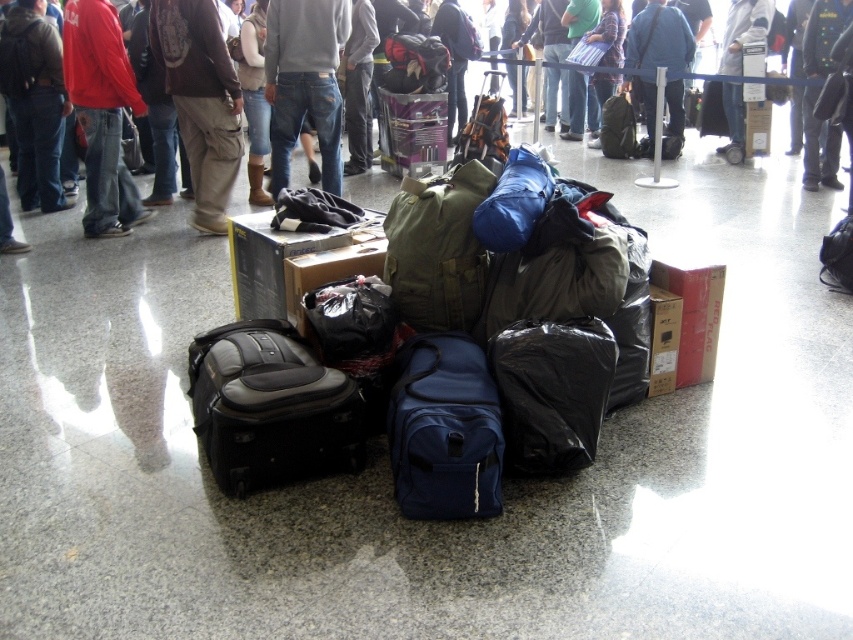
Which is below, matte black suitcase at center or navy blue fabric backpack at center?

navy blue fabric backpack at center is lower down.

Is matte black suitcase at center bigger than navy blue fabric backpack at center?

Indeed, matte black suitcase at center has a larger size compared to navy blue fabric backpack at center.

Identify the location of matte black suitcase at center. (270, 406).

The width and height of the screenshot is (853, 640). What are the coordinates of `matte black suitcase at center` in the screenshot? It's located at pos(270,406).

Who is more distant from viewer, (289, 419) or (300, 22)?

The point (300, 22) is more distant.

Measure the distance from matte black suitcase at center to jeans at center.

matte black suitcase at center and jeans at center are 8.96 feet apart.

Between point (207, 397) and point (331, 10), which one is positioned behind?

Positioned behind is point (331, 10).

Where is `matte black suitcase at center`? This screenshot has height=640, width=853. matte black suitcase at center is located at coordinates (270, 406).

Can you confirm if navy blue fabric backpack at center is positioned below jeans at center?

Result: Yes, navy blue fabric backpack at center is below jeans at center.

Between navy blue fabric backpack at center and jeans at center, which one has less height?

With less height is navy blue fabric backpack at center.

Identify the location of navy blue fabric backpack at center. (444, 429).